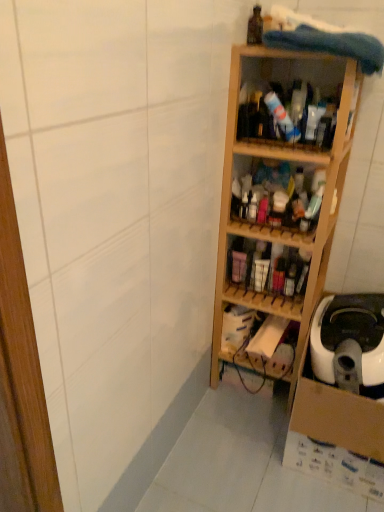
Question: From a real-world perspective, is wooden shelves at center, the second shelf viewed from the top, beneath wooden shelves at center, which ranks as the 2th shelf in bottom-to-top order?

Choices:
 (A) yes
 (B) no

Answer: (B)

Question: Can you confirm if wooden shelves at center, the second shelf viewed from the top, is shorter than wooden shelves at center, which ranks as the 2th shelf in bottom-to-top order?

Choices:
 (A) no
 (B) yes

Answer: (A)

Question: From a real-world perspective, is wooden shelves at center, acting as the fourth shelf starting from the bottom, on top of wooden shelves at center, the fourth shelf positioned from the top?

Choices:
 (A) no
 (B) yes

Answer: (B)

Question: Is the surface of wooden shelves at center, acting as the fourth shelf starting from the bottom, in direct contact with wooden shelves at center, which ranks as the 2th shelf in bottom-to-top order?

Choices:
 (A) yes
 (B) no

Answer: (B)

Question: From the image's perspective, does wooden shelves at center, the second shelf viewed from the top, appear lower than wooden shelves at center, which ranks as the 2th shelf in bottom-to-top order?

Choices:
 (A) yes
 (B) no

Answer: (B)

Question: Does wooden shelves at center, acting as the fourth shelf starting from the bottom, have a larger size compared to wooden shelves at center, the fourth shelf positioned from the top?

Choices:
 (A) yes
 (B) no

Answer: (A)

Question: From a real-world perspective, is light wood shelf at center, the third shelf viewed from the top, positioned over wooden shelves at center, the fourth shelf positioned from the top, based on gravity?

Choices:
 (A) yes
 (B) no

Answer: (A)

Question: Is light wood shelf at center, which ranks as the third shelf in bottom-to-top order, wider than wooden shelves at center, which ranks as the 2th shelf in bottom-to-top order?

Choices:
 (A) yes
 (B) no

Answer: (A)

Question: From a real-world perspective, is light wood shelf at center, which ranks as the third shelf in bottom-to-top order, located beneath wooden shelves at center, the fourth shelf positioned from the top?

Choices:
 (A) yes
 (B) no

Answer: (B)

Question: Does light wood shelf at center, the third shelf viewed from the top, lie in front of wooden shelves at center, which ranks as the 2th shelf in bottom-to-top order?

Choices:
 (A) yes
 (B) no

Answer: (A)

Question: Is light wood shelf at center, which ranks as the third shelf in bottom-to-top order, aimed at wooden shelves at center, which ranks as the 2th shelf in bottom-to-top order?

Choices:
 (A) no
 (B) yes

Answer: (B)

Question: Can you confirm if light wood shelf at center, the third shelf viewed from the top, is shorter than wooden shelves at center, the fourth shelf positioned from the top?

Choices:
 (A) no
 (B) yes

Answer: (A)

Question: Is wooden shelf at center, which is the 1th shelf from top to bottom, taller than light wood shelf at center, which ranks as the third shelf in bottom-to-top order?

Choices:
 (A) yes
 (B) no

Answer: (B)